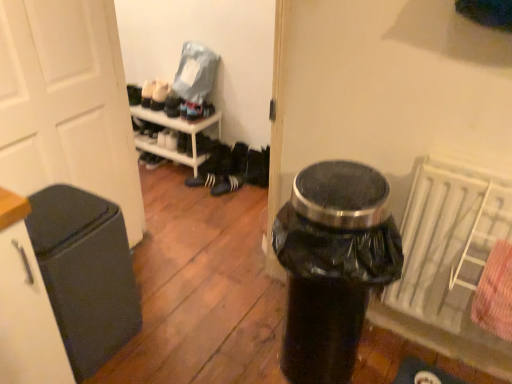
Question: Is white textured radiator at right shorter than black matte sneakers at center, the second footwear from the right?

Choices:
 (A) yes
 (B) no

Answer: (B)

Question: Does white textured radiator at right appear on the right side of black matte sneakers at center, the first footwear viewed from the left?

Choices:
 (A) yes
 (B) no

Answer: (A)

Question: Is the position of white textured radiator at right less distant than that of black matte sneakers at center, the first footwear viewed from the left?

Choices:
 (A) yes
 (B) no

Answer: (A)

Question: Is the depth of white textured radiator at right greater than that of black matte sneakers at center, the second footwear from the right?

Choices:
 (A) no
 (B) yes

Answer: (A)

Question: Considering the relative positions of white textured radiator at right and black matte sneakers at center, the first footwear viewed from the left, in the image provided, is white textured radiator at right to the left of black matte sneakers at center, the first footwear viewed from the left, from the viewer's perspective?

Choices:
 (A) yes
 (B) no

Answer: (B)

Question: Is white textured radiator at right taller than black matte sneakers at center, the first footwear viewed from the left?

Choices:
 (A) no
 (B) yes

Answer: (B)

Question: Does black matte trash can at left touch black plastic trash can at center?

Choices:
 (A) yes
 (B) no

Answer: (B)

Question: Does black matte trash can at left come in front of black plastic trash can at center?

Choices:
 (A) yes
 (B) no

Answer: (B)

Question: Can you confirm if black matte trash can at left is shorter than black plastic trash can at center?

Choices:
 (A) yes
 (B) no

Answer: (A)

Question: Is black matte trash can at left outside of black plastic trash can at center?

Choices:
 (A) no
 (B) yes

Answer: (B)

Question: From the image's perspective, would you say black matte trash can at left is positioned over black plastic trash can at center?

Choices:
 (A) no
 (B) yes

Answer: (A)

Question: Does black matte trash can at left appear on the left side of black plastic trash can at center?

Choices:
 (A) no
 (B) yes

Answer: (B)

Question: Is there a large distance between black matte sneakers at center, the second footwear from the right, and black matte trash can at left?

Choices:
 (A) yes
 (B) no

Answer: (A)